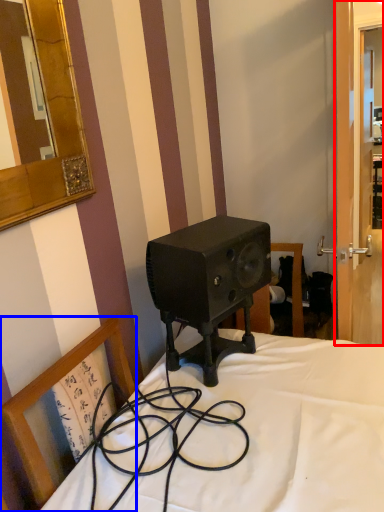
Question: Which of the following is the farthest to the observer, screen door (highlighted by a red box) or chair (highlighted by a blue box)?

Choices:
 (A) screen door
 (B) chair

Answer: (A)